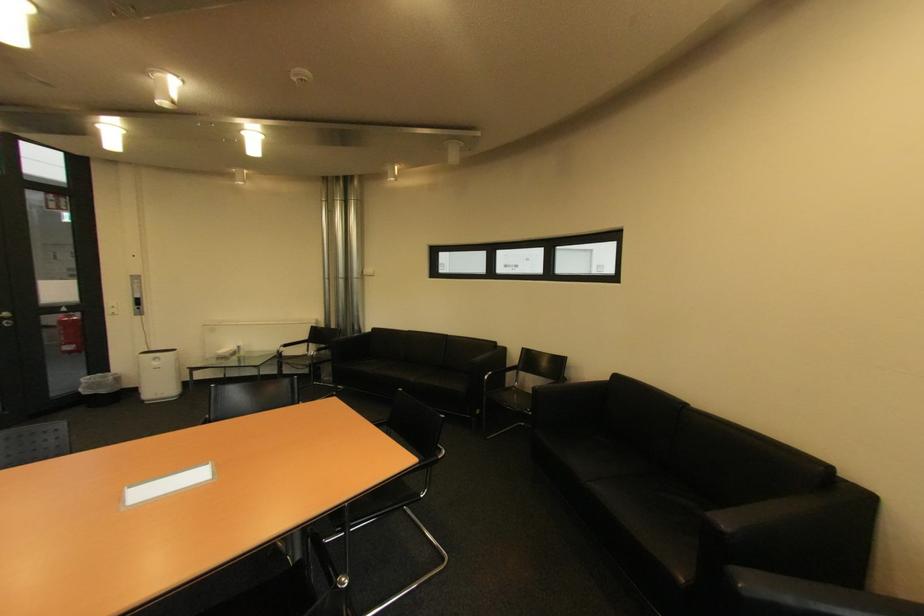
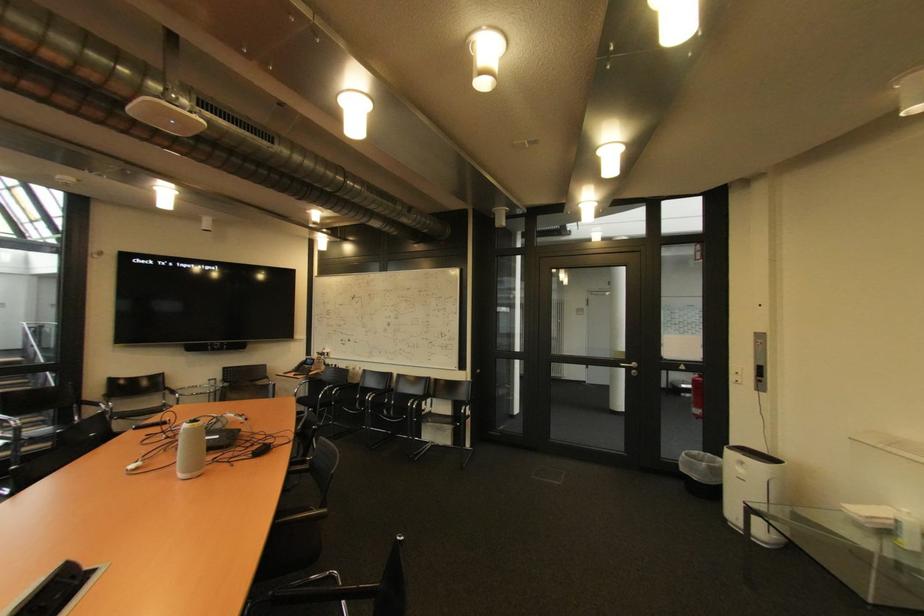
Locate, in the second image, the point that corresponds to [164,363] in the first image.

(748, 471)